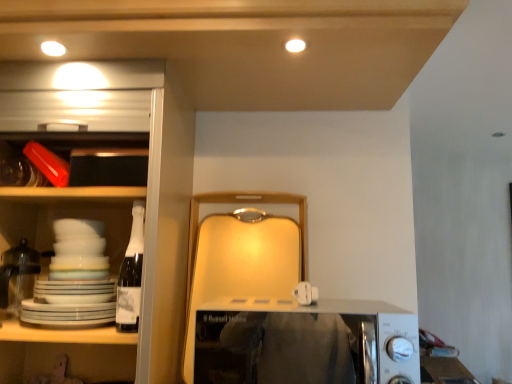
Question: Is white plastic microwave at center closer to the viewer compared to white glossy cabinet at left?

Choices:
 (A) yes
 (B) no

Answer: (A)

Question: From the image's perspective, is white plastic microwave at center under white glossy cabinet at left?

Choices:
 (A) no
 (B) yes

Answer: (B)

Question: Is the depth of white plastic microwave at center greater than that of white glossy cabinet at left?

Choices:
 (A) no
 (B) yes

Answer: (A)

Question: Is white glossy cabinet at left inside white plastic microwave at center?

Choices:
 (A) yes
 (B) no

Answer: (B)

Question: Can you confirm if white plastic microwave at center is shorter than white glossy cabinet at left?

Choices:
 (A) yes
 (B) no

Answer: (A)

Question: Is white plastic microwave at center not within white glossy cabinet at left?

Choices:
 (A) yes
 (B) no

Answer: (A)

Question: Does white glossy cabinet at left lie behind white plastic microwave at center?

Choices:
 (A) no
 (B) yes

Answer: (B)

Question: Considering the relative sizes of white glossy cabinet at left and white plastic microwave at center in the image provided, is white glossy cabinet at left shorter than white plastic microwave at center?

Choices:
 (A) yes
 (B) no

Answer: (B)

Question: Is white glossy cabinet at left at the left side of white plastic microwave at center?

Choices:
 (A) no
 (B) yes

Answer: (B)

Question: Considering the relative sizes of white glossy cabinet at left and white plastic microwave at center in the image provided, is white glossy cabinet at left thinner than white plastic microwave at center?

Choices:
 (A) no
 (B) yes

Answer: (A)

Question: Is white glossy cabinet at left positioned with its back to white plastic microwave at center?

Choices:
 (A) no
 (B) yes

Answer: (A)

Question: Is white glossy cabinet at left smaller than white plastic microwave at center?

Choices:
 (A) no
 (B) yes

Answer: (A)

Question: Looking at the image, does white glossy cabinet at left seem bigger or smaller compared to white plastic microwave at center?

Choices:
 (A) big
 (B) small

Answer: (A)